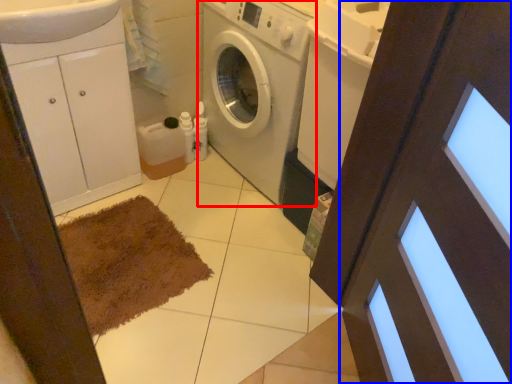
Question: Which point is closer to the camera, washing machine (highlighted by a red box) or screen door (highlighted by a blue box)?

Choices:
 (A) washing machine
 (B) screen door

Answer: (B)